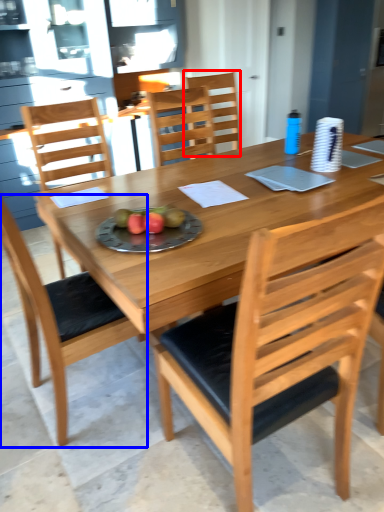
Question: Which object appears farthest to the camera in this image, chair (highlighted by a red box) or chair (highlighted by a blue box)?

Choices:
 (A) chair
 (B) chair

Answer: (A)